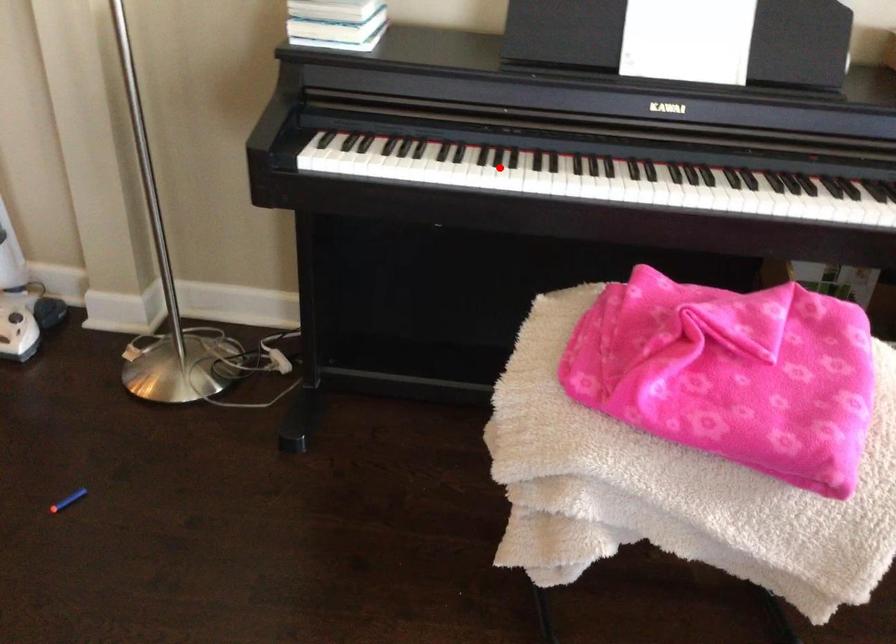
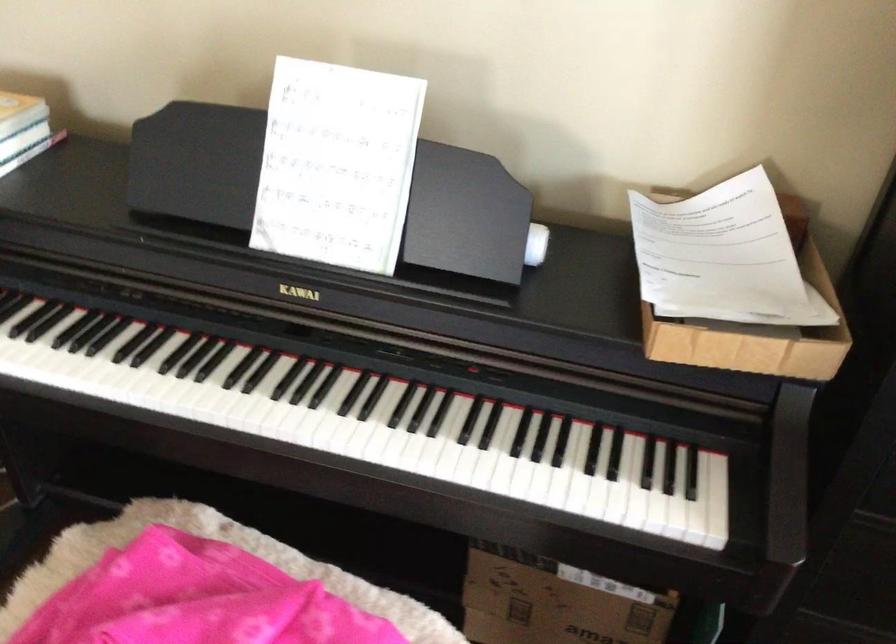
Question: I am providing you with two images of the same scene from different viewpoints. Image1 has a red point marked. In image2, the corresponding 3D location appears at what relative position? Reply with the corresponding letter.

Choices:
 (A) Closer
 (B) Farther

Answer: (A)